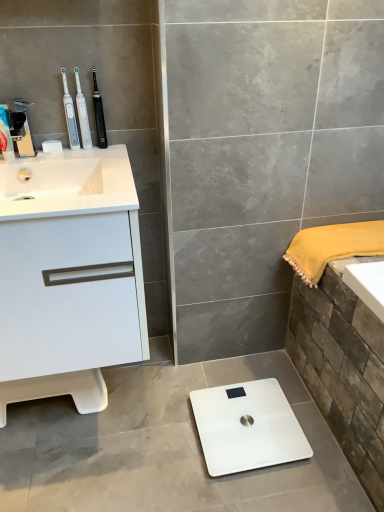
At what (x,y) coordinates should I click in order to perform the action: click on vacant space in front of white plastic toothbrush at upper left, the 2th toothbrush when ordered from right to left. Please return your answer as a coordinate pair (x, y). The width and height of the screenshot is (384, 512). Looking at the image, I should click on (88, 159).